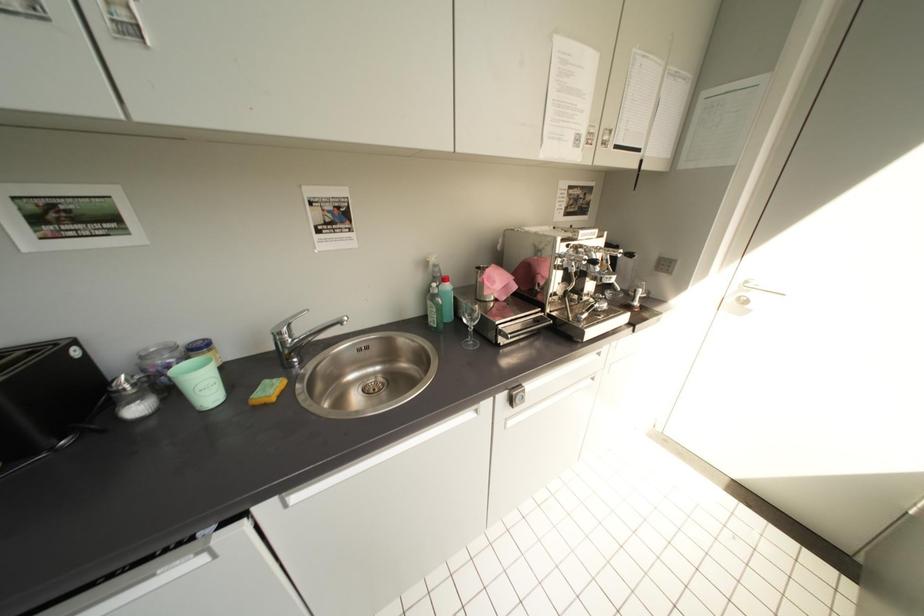
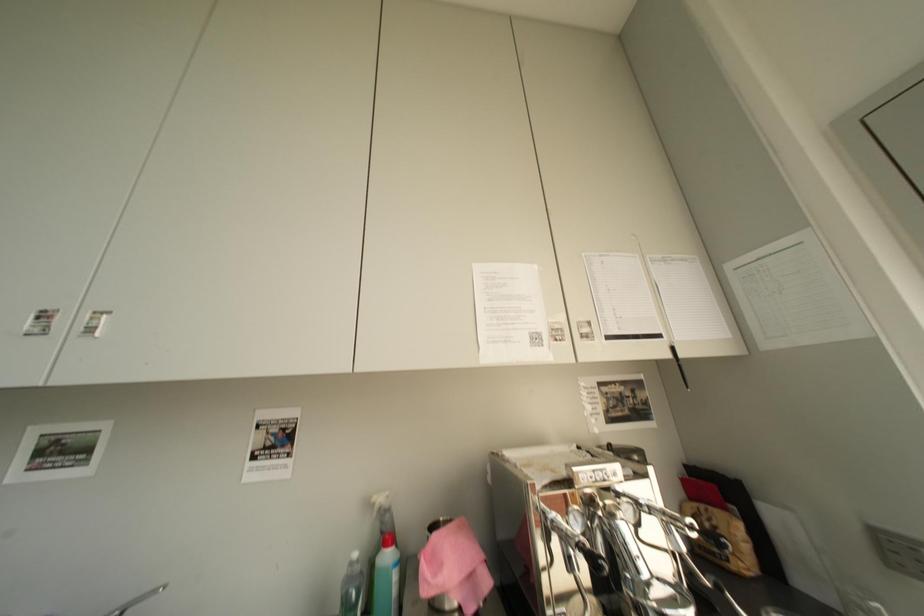
First-person continuous shooting, in which direction is the camera rotating?

The camera's rotation is toward left-up.